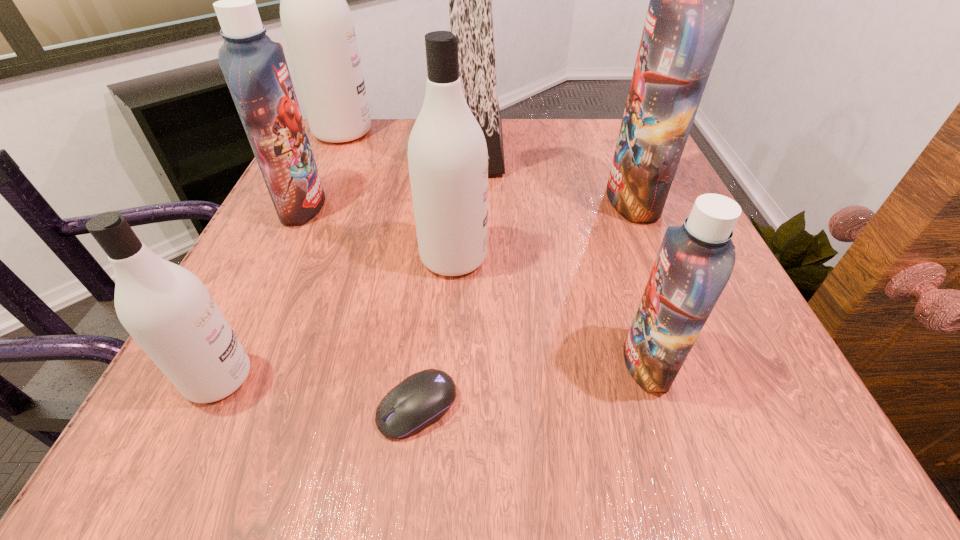
Where is `vacant region located 0.150m on the front label of the nearest blue shampoo`? The image size is (960, 540). vacant region located 0.150m on the front label of the nearest blue shampoo is located at coordinates (517, 362).

At what (x,y) coordinates should I click in order to perform the action: click on vacant space located 0.390m on the front-facing side of the smallest white shampoo. Please return your answer as a coordinate pair (x, y). The width and height of the screenshot is (960, 540). Looking at the image, I should click on (537, 378).

At what (x,y) coordinates should I click in order to perform the action: click on free location located on the left of the shortest object. Please return your answer as a coordinate pair (x, y). Looking at the image, I should click on (294, 407).

At what (x,y) coordinates should I click in order to perform the action: click on shopping bag that is at the far edge. Please return your answer as a coordinate pair (x, y). Looking at the image, I should click on (470, 0).

The height and width of the screenshot is (540, 960). I want to click on shampoo present at the far edge, so click(317, 23).

Find the location of a particular element. Image resolution: width=960 pixels, height=540 pixels. computer mouse located at the near edge is located at coordinates (423, 398).

What are the coordinates of `object situated at the far left corner` in the screenshot? It's located at (317, 23).

This screenshot has height=540, width=960. In order to click on object positioned at the near left corner in this screenshot , I will do `click(168, 311)`.

This screenshot has height=540, width=960. Find the location of `object present at the near right corner`. object present at the near right corner is located at coordinates (695, 261).

In the image, there is a desktop. Where is `free space at the far edge`? The width and height of the screenshot is (960, 540). free space at the far edge is located at coordinates (503, 126).